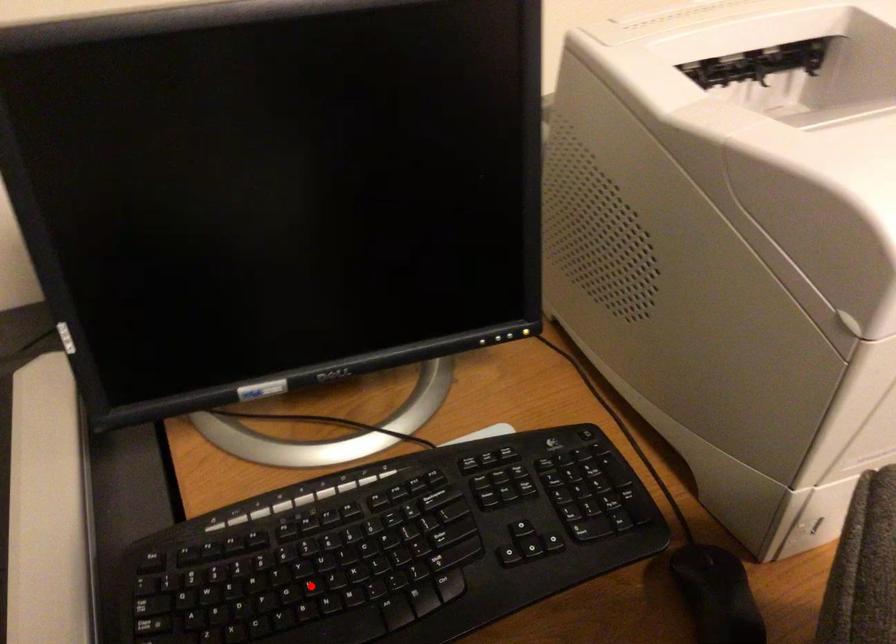
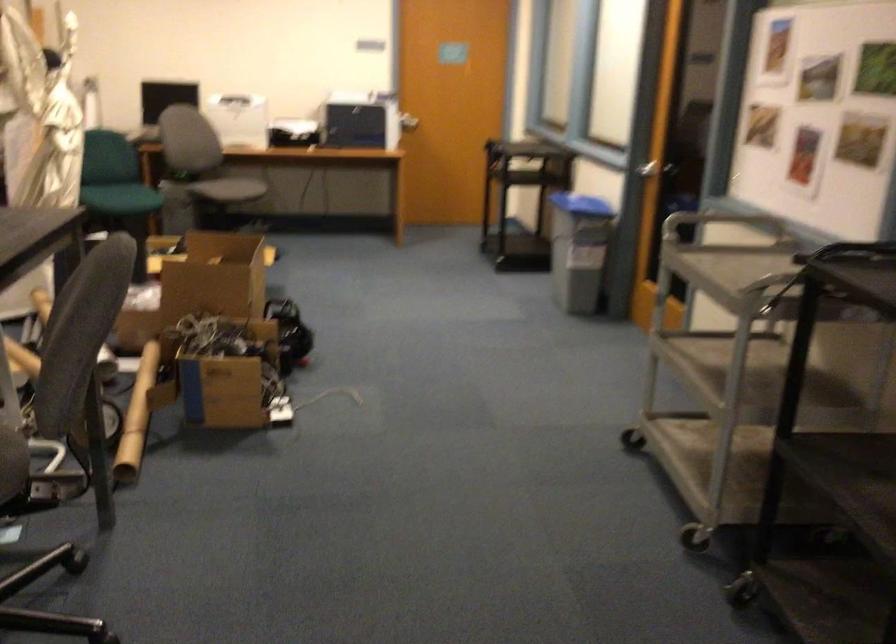
Question: I am providing you with two images of the same scene from different viewpoints. A red point is marked on the first image. Can you still see the location of the red point in image 2?

Choices:
 (A) Yes
 (B) No

Answer: (B)